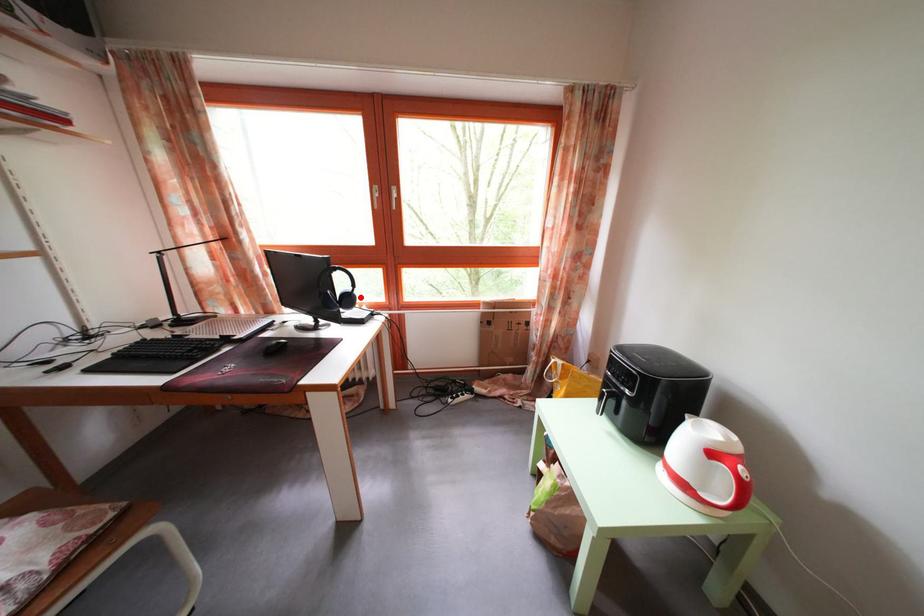
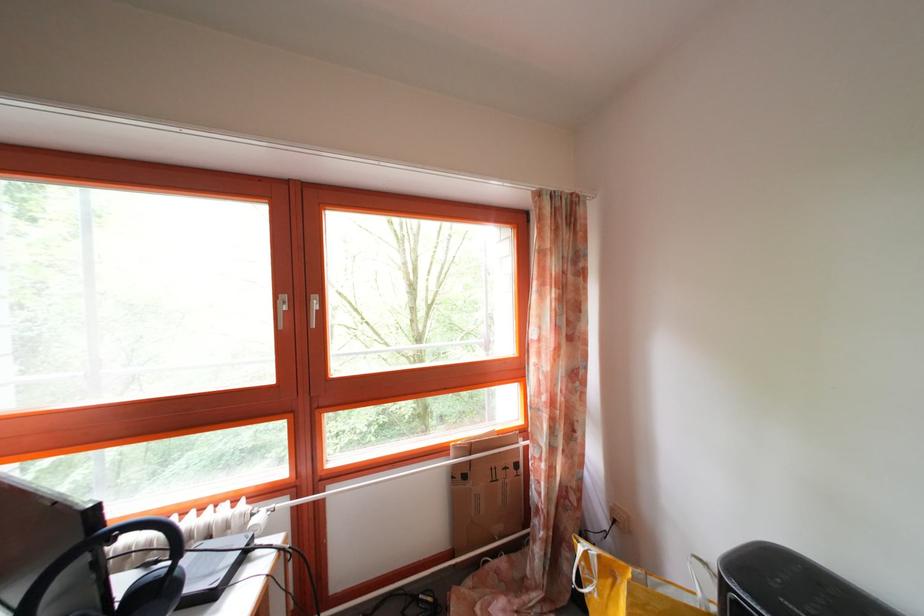
Find the pixel in the second image that matches the highlighted location in the first image.

(179, 573)